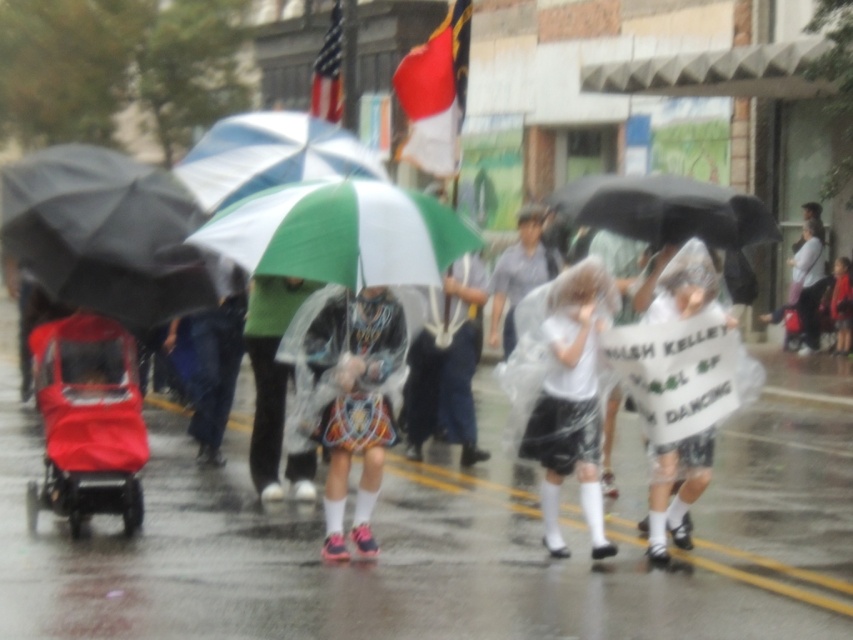
You are a photographer trying to capture a clear shot of the white matte shirt at center without the red fabric stroller at left blocking it. Since the stroller is shorter, can you adjust your camera angle to avoid the stroller while still focusing on the shirt?

The red fabric stroller at left is shorter than the white matte shirt at center. By lowering your camera angle, you can position it below the stroller while still keeping the white matte shirt at center in focus, thus avoiding the obstruction.